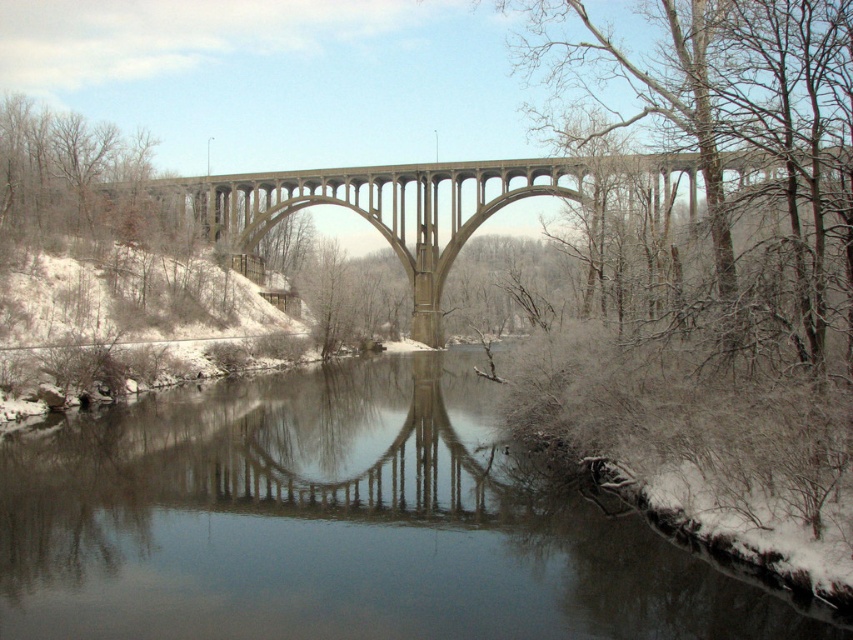
Between snow-covered branches at upper right and concrete bridge at center, which one is positioned higher?

snow-covered branches at upper right is higher up.

Can you confirm if snow-covered branches at upper right is positioned below concrete bridge at center?

No.

Who is more distant from viewer, (720, 269) or (409, 225)?

The point (409, 225) is behind.

Identify the location of snow-covered branches at upper right. (741, 131).

Who is higher up, clear water at center or snow-covered branches at upper right?

snow-covered branches at upper right

Does point (49, 512) come behind point (813, 316)?

That is True.

Locate an element on the screen. clear water at center is located at coordinates click(335, 522).

Who is more distant from viewer, (260, 544) or (657, 202)?

Point (657, 202)

Who is shorter, clear water at center or concrete bridge at center?

clear water at center

Looking at this image, who is more distant from viewer, (292, 474) or (726, 273)?

The point (292, 474) is more distant.

This screenshot has width=853, height=640. I want to click on clear water at center, so click(335, 522).